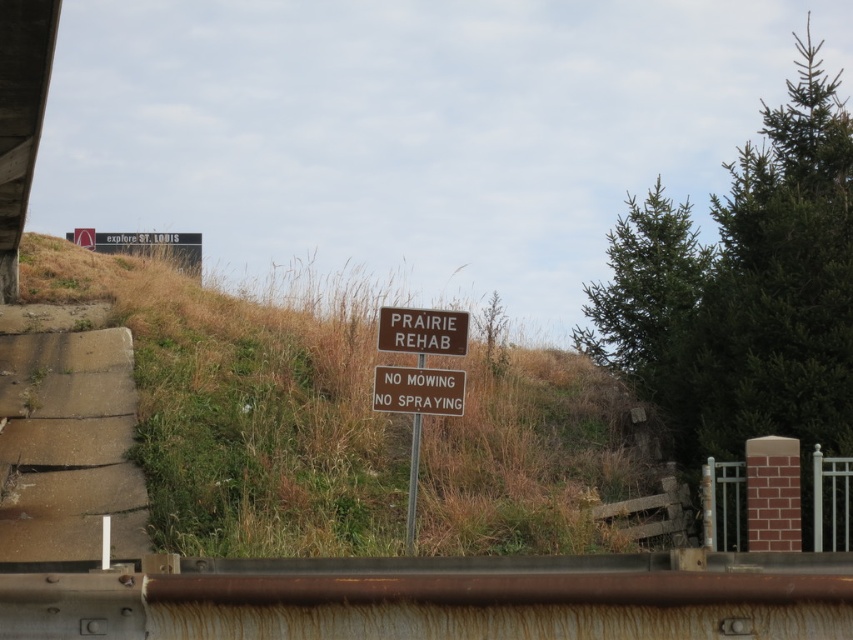
Question: Which of these objects is positioned closest to the brown metal sign at center?

Choices:
 (A) brown matte sign at center
 (B) brown grass at center
 (C) brown wooden sign at center

Answer: (A)

Question: Based on their relative distances, which object is nearer to the brown matte sign at center?

Choices:
 (A) brown wooden sign at center
 (B) brown grass at center
 (C) brown metal sign at center
 (D) concrete at left

Answer: (C)

Question: Is brown grass at center to the right of concrete at left from the viewer's perspective?

Choices:
 (A) yes
 (B) no

Answer: (A)

Question: Considering the relative positions of concrete at left and brown metal sign at center in the image provided, where is concrete at left located with respect to brown metal sign at center?

Choices:
 (A) left
 (B) right

Answer: (A)

Question: Which of the following is the closest to the observer?

Choices:
 (A) (416, 396)
 (B) (465, 346)
 (C) (451, 378)

Answer: (A)

Question: Is brown grass at center above concrete at left?

Choices:
 (A) yes
 (B) no

Answer: (B)